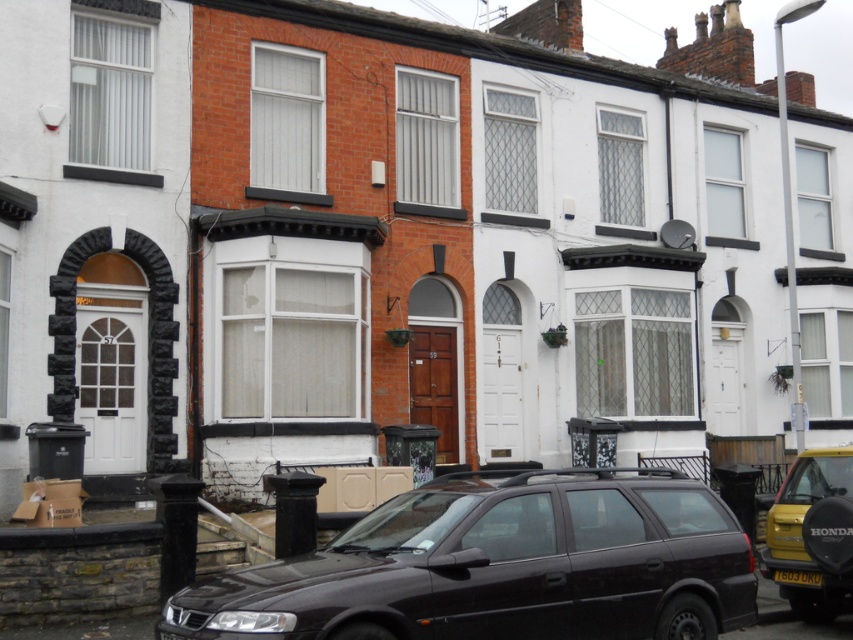
You are a delivery driver who needs to park your vehicle in the parking area near the row of terraced houses. The parking spot is currently occupied by the matte black car at center and the yellow matte van at lower right. Which vehicle should you move to access the parking spot?

The matte black car at center is positioned over the yellow matte van at lower right, so you should move the matte black car at center first to access the parking spot.

You are a delivery person standing at the entrance of the row of terraced houses. You need to park your matte black car at center so that its yellow plastic license plate at lower center is visible from the street. Given the distance between them is 3.10 meters, can you estimate whether the license plate will be visible from the street if the car is parked facing the entrance?

The matte black car at center and yellow plastic license plate at lower center are 3.10 meters apart. Since the license plate is located at the lower center of the car, when parked facing the entrance, it should be visible from the street as the distance between them does not obstruct the view.